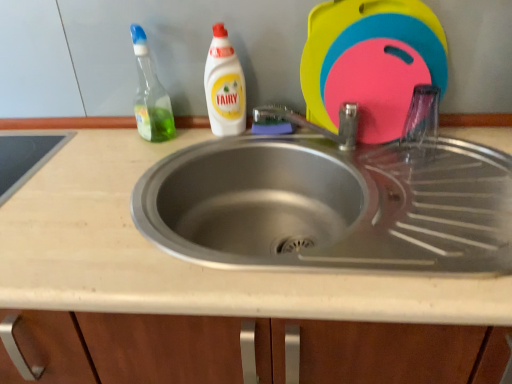
Question: Is the depth of beige laminate countertop at center greater than that of green translucent bottle at upper left, placed as the 1th cleaning product when sorted from left to right?

Choices:
 (A) yes
 (B) no

Answer: (B)

Question: Considering the relative positions of beige laminate countertop at center and green translucent bottle at upper left, acting as the second cleaning product starting from the right, in the image provided, is beige laminate countertop at center to the left of green translucent bottle at upper left, acting as the second cleaning product starting from the right, from the viewer's perspective?

Choices:
 (A) no
 (B) yes

Answer: (A)

Question: From a real-world perspective, is beige laminate countertop at center positioned under green translucent bottle at upper left, placed as the 1th cleaning product when sorted from left to right, based on gravity?

Choices:
 (A) yes
 (B) no

Answer: (A)

Question: Is beige laminate countertop at center positioned with its back to green translucent bottle at upper left, acting as the second cleaning product starting from the right?

Choices:
 (A) no
 (B) yes

Answer: (A)

Question: Is beige laminate countertop at center not within green translucent bottle at upper left, placed as the 1th cleaning product when sorted from left to right?

Choices:
 (A) no
 (B) yes

Answer: (B)

Question: Is beige laminate countertop at center inside the boundaries of white plastic bottle at upper center, the second cleaning product when ordered from left to right, or outside?

Choices:
 (A) inside
 (B) outside

Answer: (B)

Question: Considering the positions of point (163, 253) and point (222, 69), is point (163, 253) closer or farther from the camera than point (222, 69)?

Choices:
 (A) farther
 (B) closer

Answer: (B)

Question: Is beige laminate countertop at center to the left or to the right of white plastic bottle at upper center, the second cleaning product when ordered from left to right, in the image?

Choices:
 (A) right
 (B) left

Answer: (B)

Question: From their relative heights in the image, would you say beige laminate countertop at center is taller or shorter than white plastic bottle at upper center, the second cleaning product when ordered from left to right?

Choices:
 (A) short
 (B) tall

Answer: (B)

Question: In the image, is white plastic bottle at upper center, positioned as the 1th cleaning product in right-to-left order, positioned in front of or behind green translucent bottle at upper left, acting as the second cleaning product starting from the right?

Choices:
 (A) front
 (B) behind

Answer: (B)

Question: Would you say white plastic bottle at upper center, positioned as the 1th cleaning product in right-to-left order, is inside or outside green translucent bottle at upper left, placed as the 1th cleaning product when sorted from left to right?

Choices:
 (A) inside
 (B) outside

Answer: (B)

Question: From the image's perspective, is white plastic bottle at upper center, positioned as the 1th cleaning product in right-to-left order, positioned above or below green translucent bottle at upper left, placed as the 1th cleaning product when sorted from left to right?

Choices:
 (A) below
 (B) above

Answer: (A)

Question: From a real-world perspective, is white plastic bottle at upper center, the second cleaning product when ordered from left to right, positioned above or below green translucent bottle at upper left, acting as the second cleaning product starting from the right?

Choices:
 (A) below
 (B) above

Answer: (A)

Question: From a real-world perspective, is green translucent bottle at upper left, acting as the second cleaning product starting from the right, above or below beige laminate countertop at center?

Choices:
 (A) above
 (B) below

Answer: (A)

Question: Considering the positions of green translucent bottle at upper left, acting as the second cleaning product starting from the right, and beige laminate countertop at center in the image, is green translucent bottle at upper left, acting as the second cleaning product starting from the right, bigger or smaller than beige laminate countertop at center?

Choices:
 (A) big
 (B) small

Answer: (B)